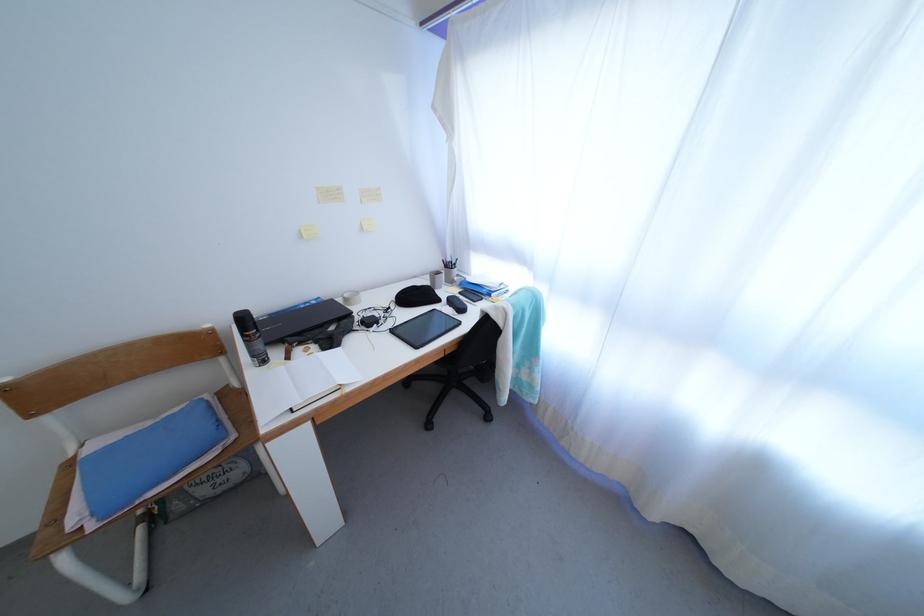
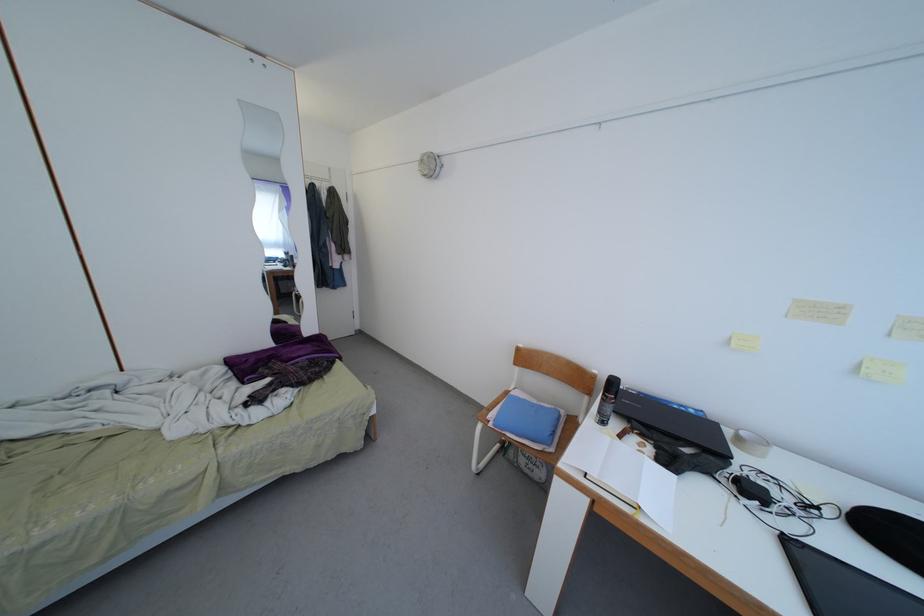
Question: The first image is from the beginning of the video and the second image is from the end. How did the camera likely rotate when shooting the video?

Choices:
 (A) Left
 (B) Right
 (C) Up
 (D) Down

Answer: (A)